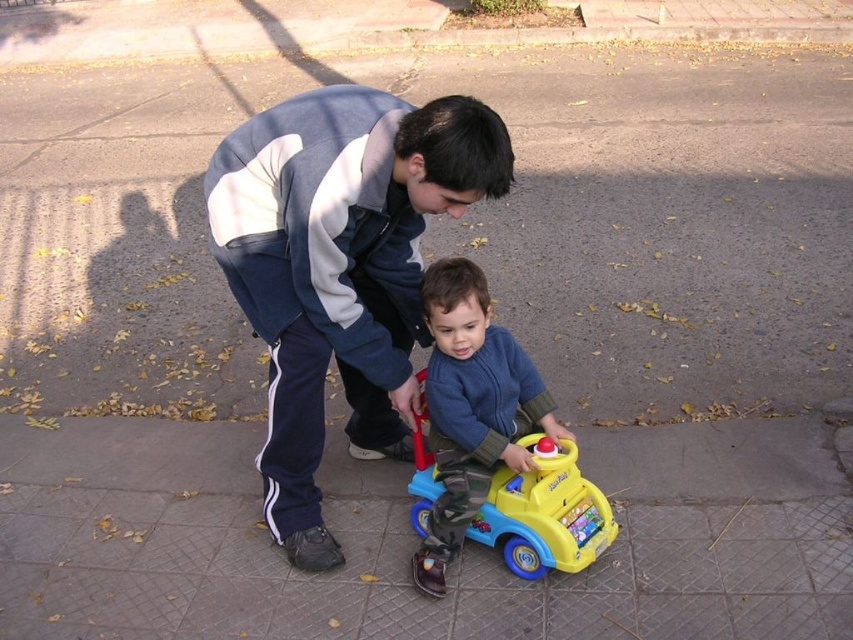
Question: Does dark blue tracksuit at center have a lesser width compared to blue soft toy car at center?

Choices:
 (A) no
 (B) yes

Answer: (A)

Question: Among these points, which one is nearest to the camera?

Choices:
 (A) (440, 308)
 (B) (331, 141)

Answer: (B)

Question: Is dark blue tracksuit at center below blue soft toy car at center?

Choices:
 (A) no
 (B) yes

Answer: (A)

Question: Considering the relative positions of dark blue tracksuit at center and blue soft toy car at center in the image provided, where is dark blue tracksuit at center located with respect to blue soft toy car at center?

Choices:
 (A) left
 (B) right

Answer: (A)